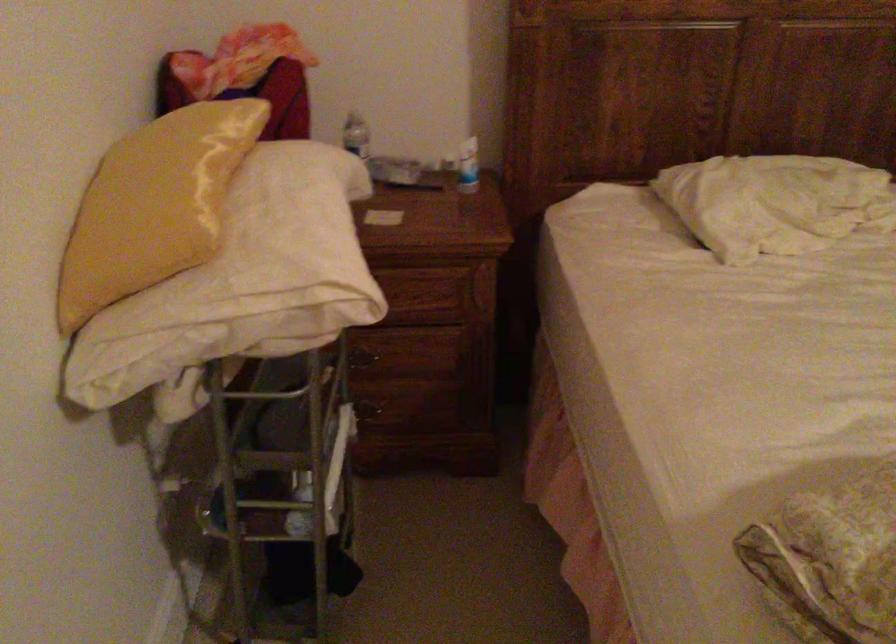
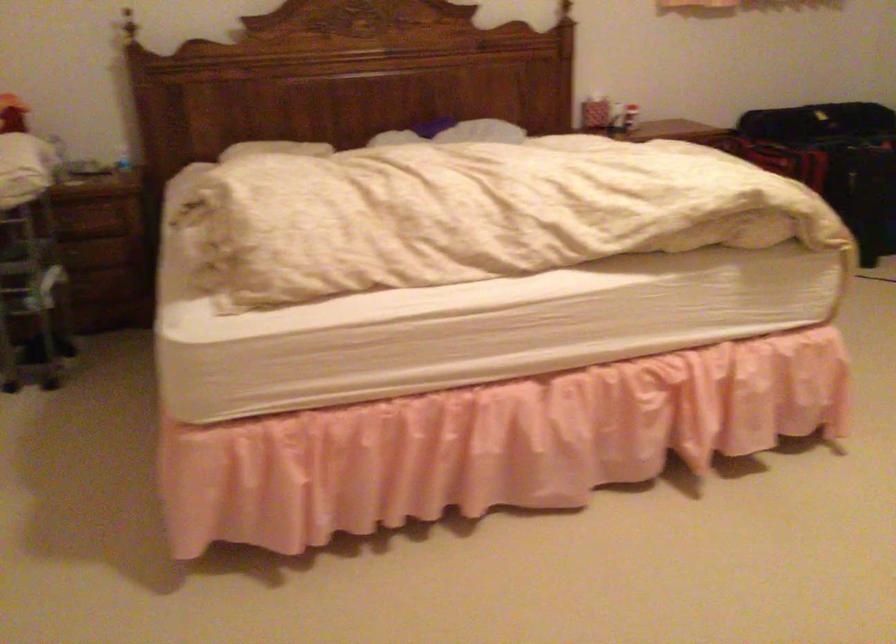
Question: Which direction would the cameraman need to move to produce the second image? Reply with the corresponding letter.

Choices:
 (A) Left
 (B) Right
 (C) Forward
 (D) Backward

Answer: (D)